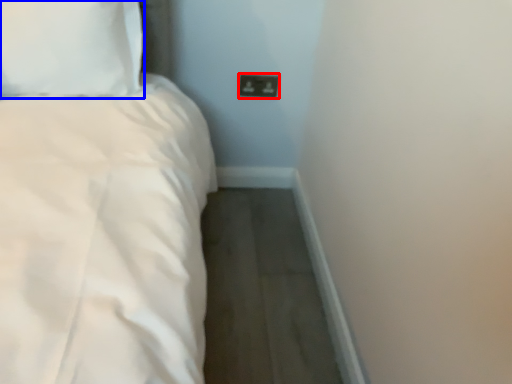
Question: Which point is further to the camera, socket (highlighted by a red box) or pillow (highlighted by a blue box)?

Choices:
 (A) socket
 (B) pillow

Answer: (A)